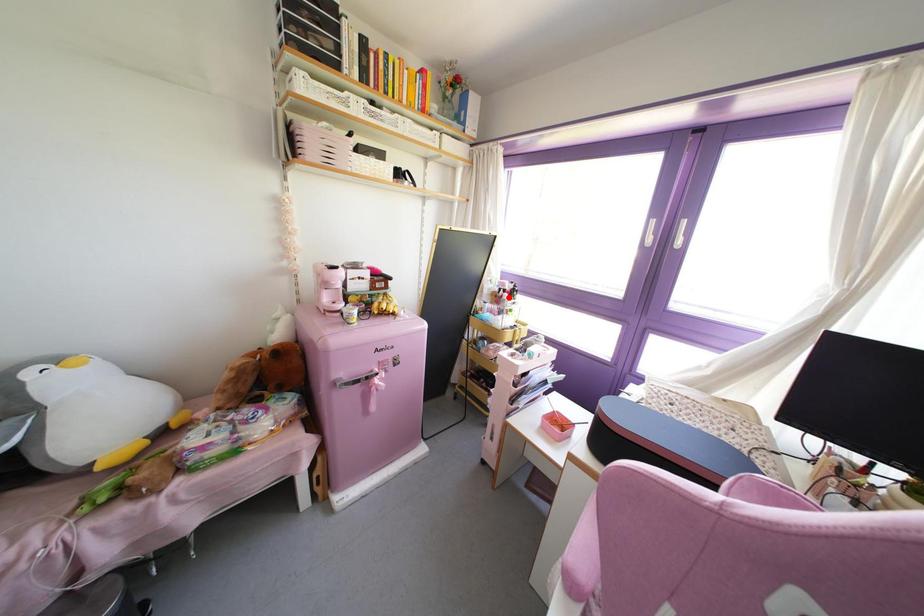
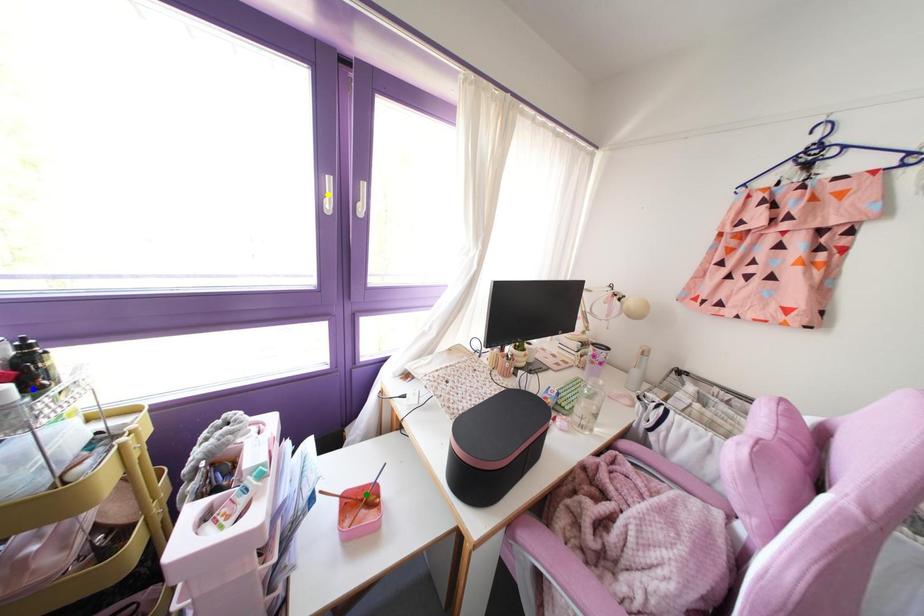
Question: I am providing you with two images of the same scene from different viewpoints. A red point is marked on the first image. You are given multiple points on the second image. Which mark in image 2 goes with the point in image 1?

Choices:
 (A) green point
 (B) yellow point
 (C) blue point

Answer: (C)